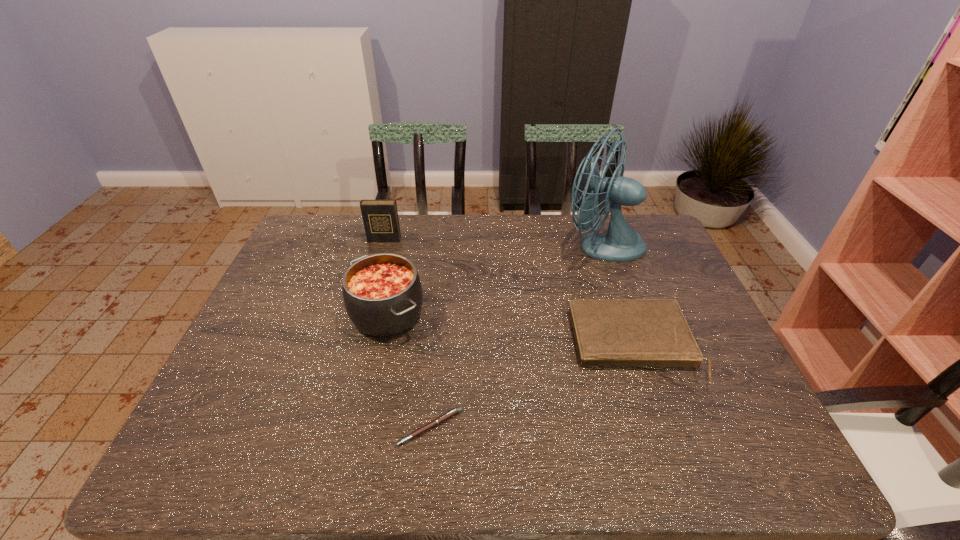
You are a GUI agent. You are given a task and a screenshot of the screen. Output one action in this format:
    pyautogui.click(x=<x>, y=<y>)
    Task: Click on the free space between the casserole and the fan
    The image size is (960, 540).
    Given the screenshot: What is the action you would take?
    pyautogui.click(x=494, y=279)

Identify the location of vacant area that lies between the casserole and the second shortest object. (511, 330).

The image size is (960, 540). I want to click on free space between the fourth tallest object and the shortest object, so click(x=532, y=387).

I want to click on blank region between the diary and the second shortest object, so click(509, 293).

Identify which object is located as the second nearest to the casserole. Please provide its 2D coordinates. Your answer should be formatted as a tuple, i.e. [(x, y)], where the tuple contains the x and y coordinates of a point satisfying the conditions above.

[(380, 217)]

The width and height of the screenshot is (960, 540). Find the location of `object that is the closest to the casserole`. object that is the closest to the casserole is located at coordinates (448, 415).

You are a GUI agent. You are given a task and a screenshot of the screen. Output one action in this format:
    pyautogui.click(x=<x>, y=<y>)
    Task: Click on the vacant area that satisfies the following two spatial constraints: 1. on the front cover of the diary; 2. on the left side of the casserole
    This screenshot has width=960, height=540.
    Given the screenshot: What is the action you would take?
    pyautogui.click(x=363, y=314)

At what (x,y) coordinates should I click in order to perform the action: click on vacant area in the image that satisfies the following two spatial constraints: 1. in front of the tallest object to blow air; 2. on the spine side of the second shortest object. Please return your answer as a coordinate pair (x, y). Looking at the image, I should click on (637, 347).